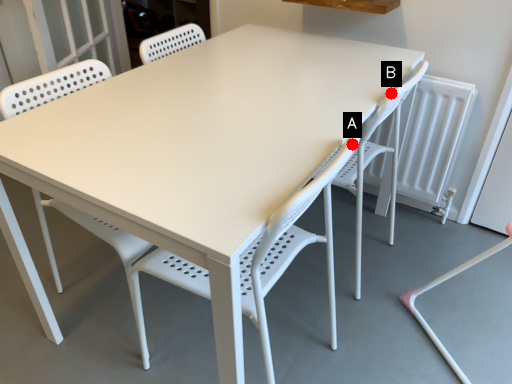
Question: Two points are circled on the image, labeled by A and B beside each circle. Among these points, which one is nearest to the camera?

Choices:
 (A) A is closer
 (B) B is closer

Answer: (A)